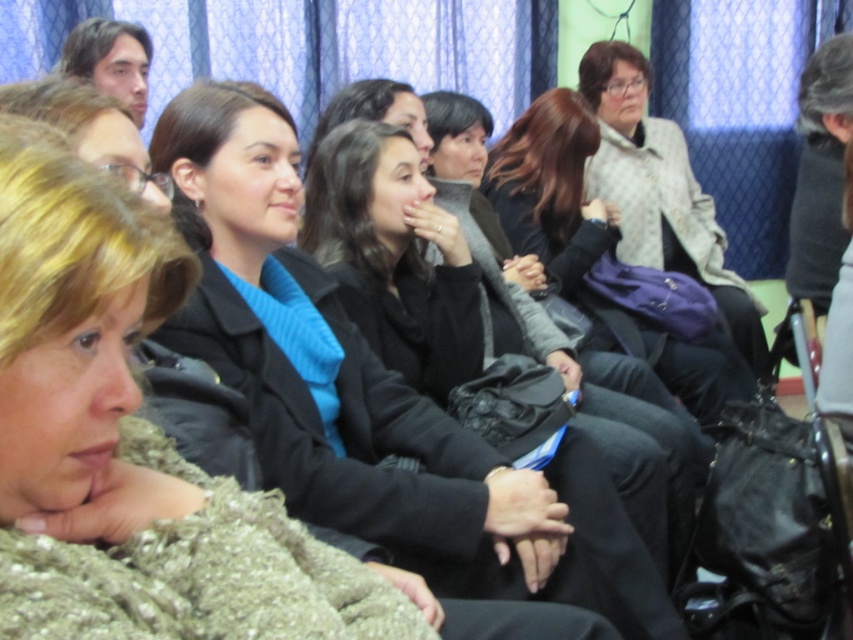
Who is lower down, knitted wool scarf at center or matte black bag at center?

knitted wool scarf at center is below.

Is knitted wool scarf at center to the left of matte black bag at center from the viewer's perspective?

Correct, you'll find knitted wool scarf at center to the left of matte black bag at center.

Locate an element on the screen. The width and height of the screenshot is (853, 640). knitted wool scarf at center is located at coordinates (68, 312).

Is blue woolen sweater at center below black leather jacket at center?

Yes, blue woolen sweater at center is below black leather jacket at center.

Identify the location of blue woolen sweater at center. This screenshot has height=640, width=853. (335, 372).

Does point (212, 228) lie in front of point (663, 496)?

Yes, point (212, 228) is closer to viewer.

Locate an element on the screen. This screenshot has width=853, height=640. blue woolen sweater at center is located at coordinates (335, 372).

Does black leather jacket at center lie behind matte black bag at center?

No, it is in front of matte black bag at center.

At what (x,y) coordinates should I click in order to perform the action: click on black leather jacket at center. Please return your answer as a coordinate pair (x, y). Looking at the image, I should click on (572, 348).